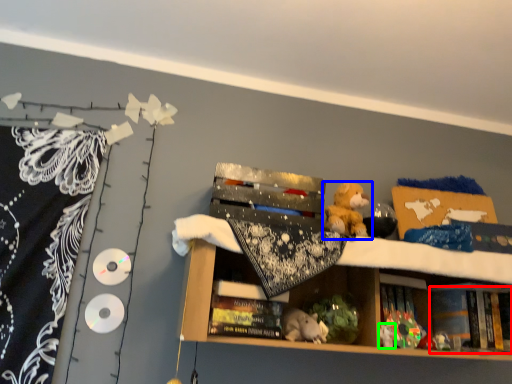
Question: Estimate the real-world distances between objects in this image. Which object is farther from book (highlighted by a red box), toy (highlighted by a blue box) or toy (highlighted by a green box)?

Choices:
 (A) toy
 (B) toy

Answer: (A)